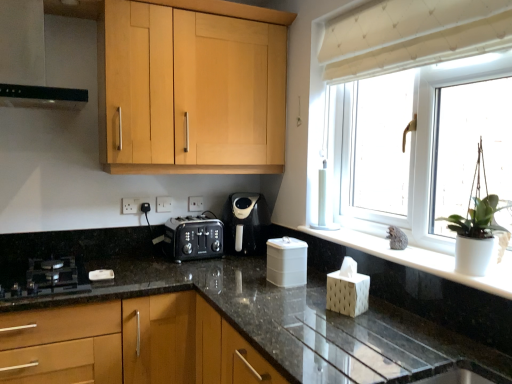
Find the location of a particular element. This screenshot has height=384, width=512. vacant space situated above white matte window sill at center (from a real-world perspective) is located at coordinates (385, 246).